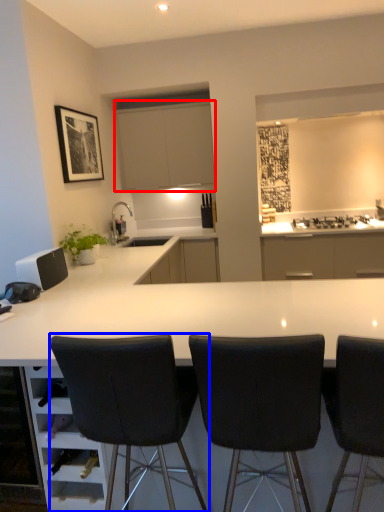
Question: Which of the following is the farthest to the observer, cabinetry (highlighted by a red box) or chair (highlighted by a blue box)?

Choices:
 (A) cabinetry
 (B) chair

Answer: (A)